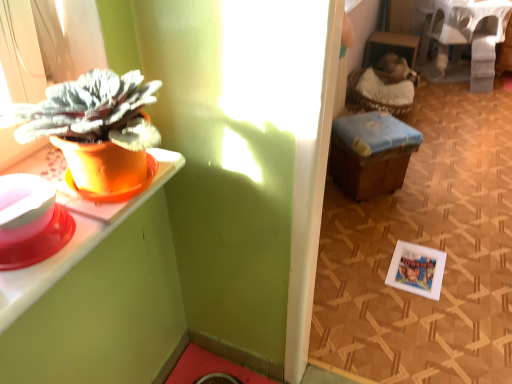
Where is `vacant area that is in front of wooden stool at center`? This screenshot has width=512, height=384. vacant area that is in front of wooden stool at center is located at coordinates (387, 235).